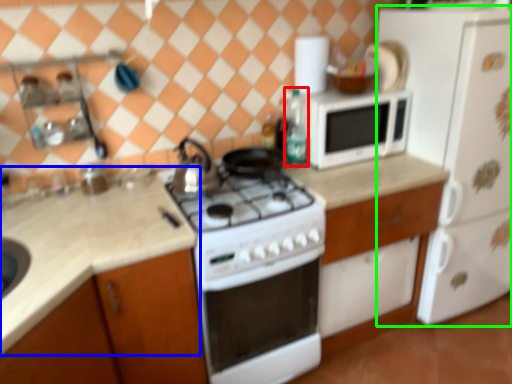
Question: Which object is the farthest from bottle (highlighted by a red box)? Choose among these: countertop (highlighted by a blue box) or refrigerator (highlighted by a green box).

Choices:
 (A) countertop
 (B) refrigerator

Answer: (A)